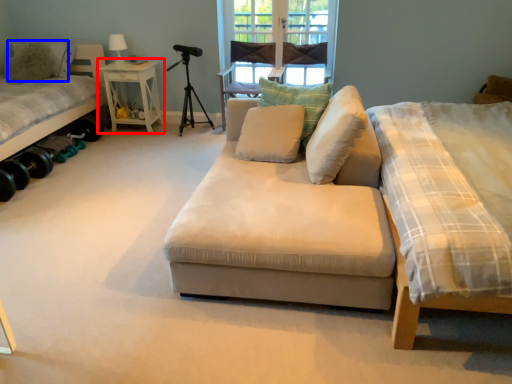
Question: Which of the following is the closest to the observer, nightstand (highlighted by a red box) or pillow (highlighted by a blue box)?

Choices:
 (A) nightstand
 (B) pillow

Answer: (B)